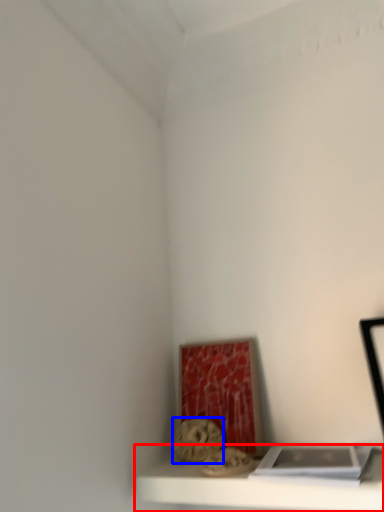
Question: Which point is closer to the camera, shelf (highlighted by a red box) or art (highlighted by a blue box)?

Choices:
 (A) shelf
 (B) art

Answer: (A)